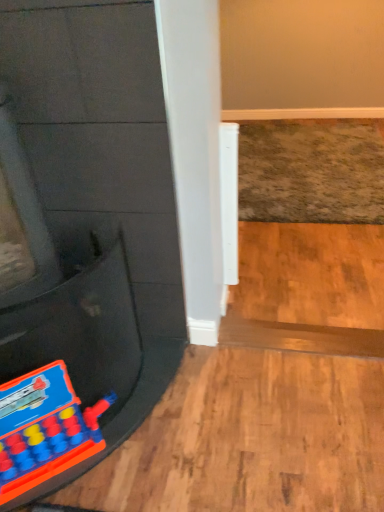
Where is `free space to the right of plastic toy train at lower left`? This screenshot has height=512, width=384. free space to the right of plastic toy train at lower left is located at coordinates (153, 454).